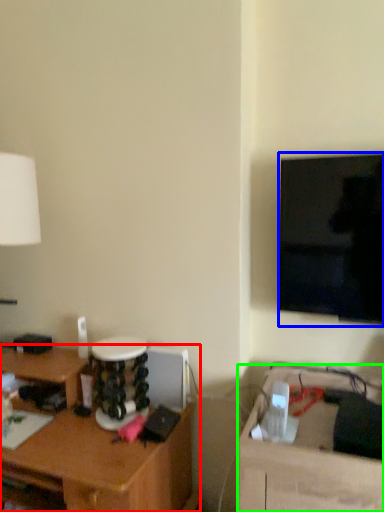
Question: Which is farther away from desk (highlighted by a red box)? television (highlighted by a blue box) or table (highlighted by a green box)?

Choices:
 (A) television
 (B) table

Answer: (A)